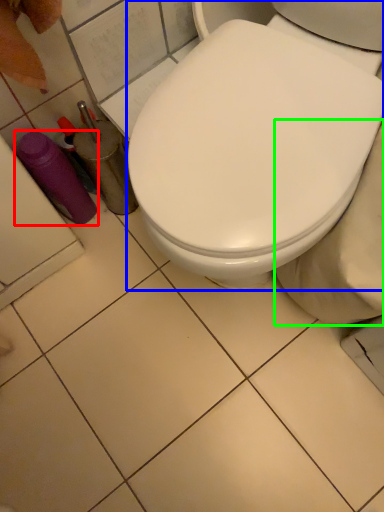
Question: Based on their relative distances, which object is farther from bottle (highlighted by a red box)? Choose from toilet (highlighted by a blue box) and bidet (highlighted by a green box).

Choices:
 (A) toilet
 (B) bidet

Answer: (B)